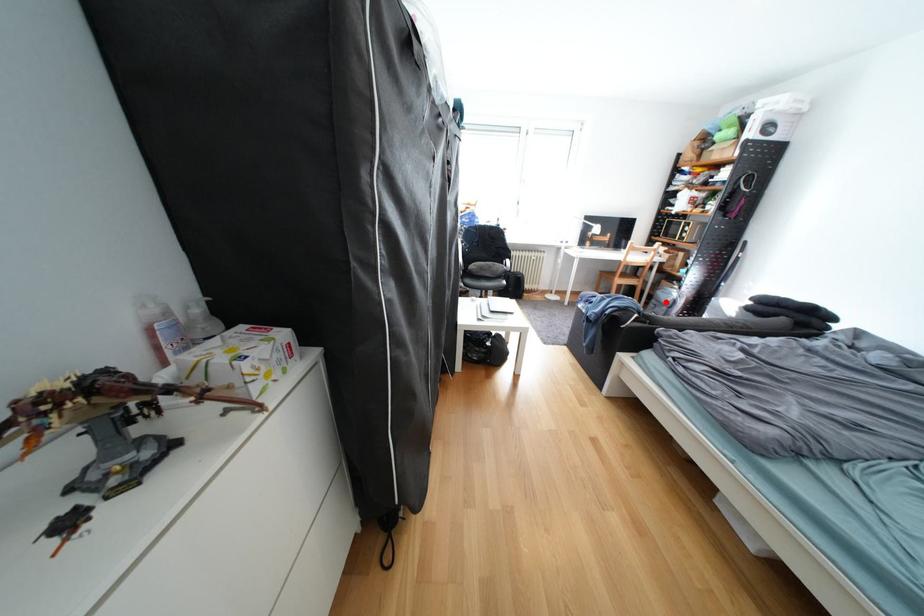
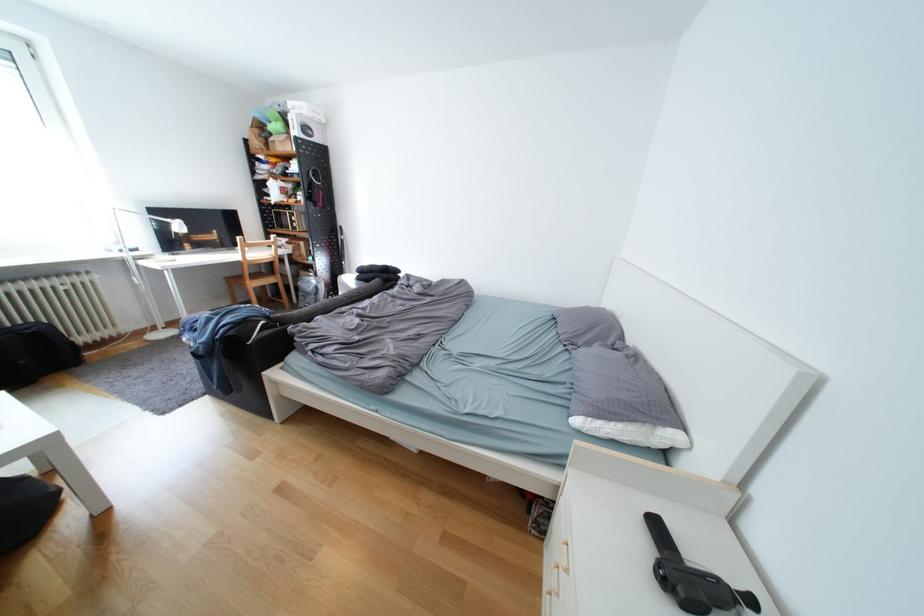
Question: A red point is marked in image1. In image2, is the corresponding 3D point closer to the camera or farther? Reply with the corresponding letter.

Choices:
 (A) The corresponding 3D point is closer.
 (B) The corresponding 3D point is farther.

Answer: (A)